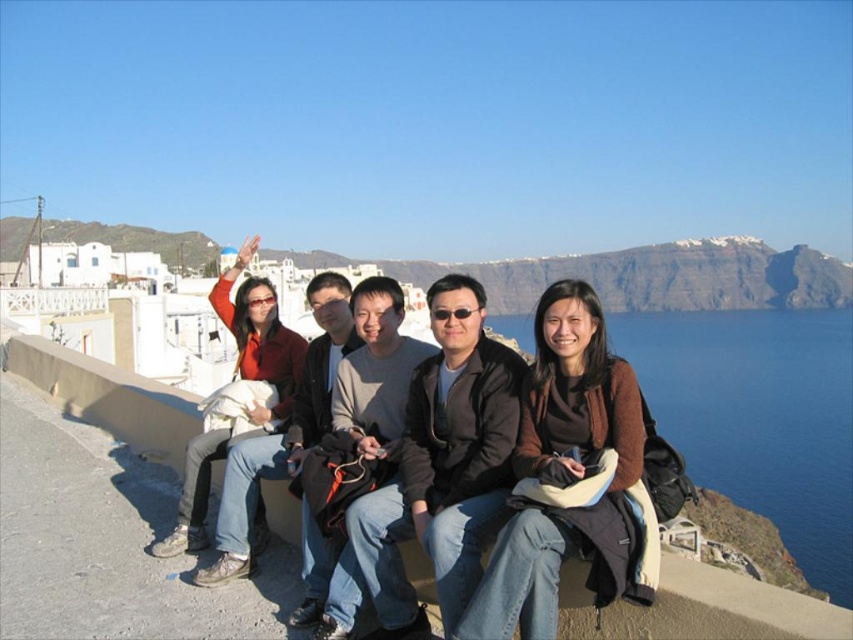
You are a photographer taking a picture of the group. You want to ensure the blue water at upper right and the dark gray jacket at center are both visible in the frame. Which object should you position closer to the left side of the camera viewfinder to achieve this?

To ensure both the blue water at upper right and the dark gray jacket at center are visible, position the dark gray jacket at center closer to the left side of the camera viewfinder. This allows the blue water at upper right to naturally appear on the right side of the frame while keeping the jacket centrally positioned.

Based on the scene description, where exactly is the blue water at upper right located in the image?

The blue water at upper right is located at point coordinates of 0.656 on the x axis and 0.891 on the y axis.